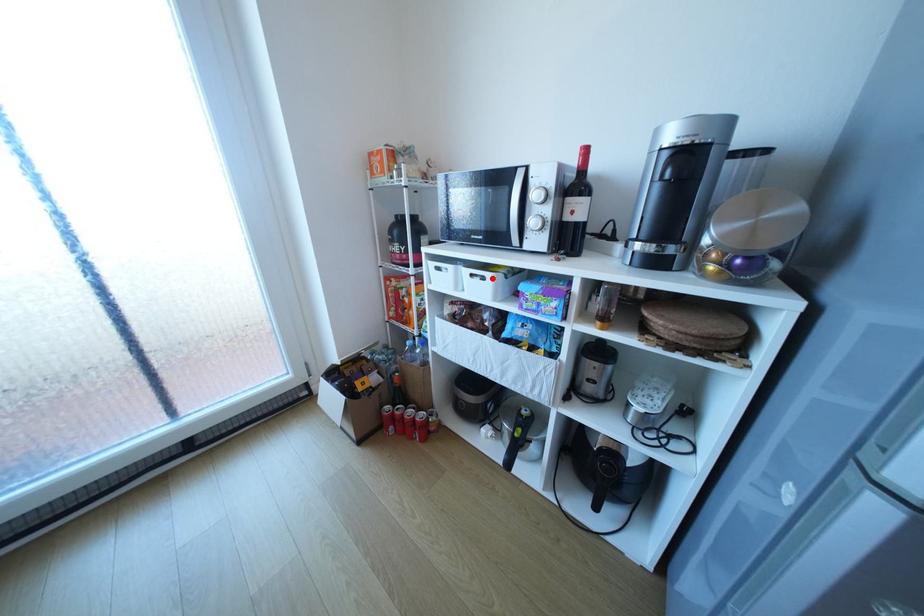
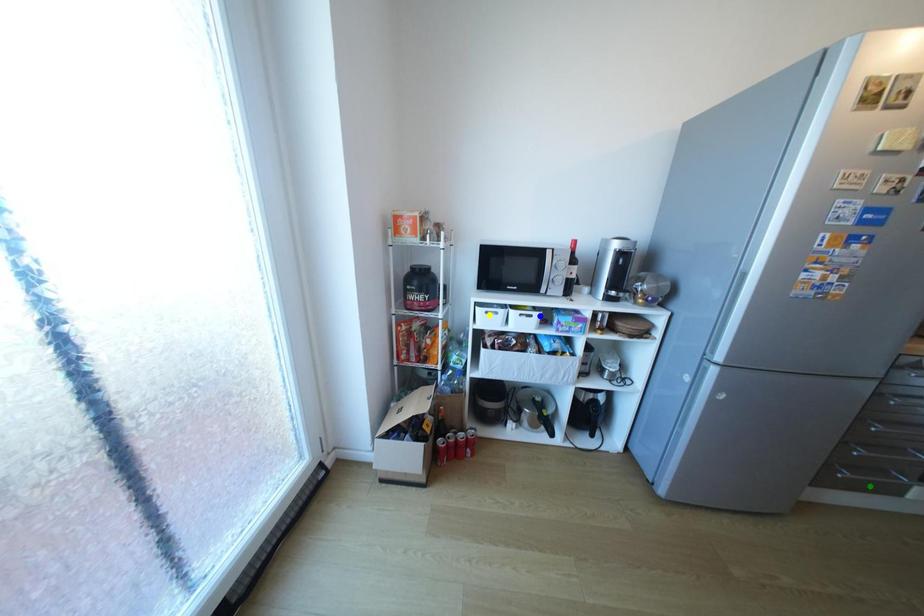
Question: I am providing you with two images of the same scene from different viewpoints. A red point is marked on the first image. You are given multiple points on the second image. Which mark in image 2 goes with the point in image 1?

Choices:
 (A) green point
 (B) yellow point
 (C) blue point

Answer: (C)